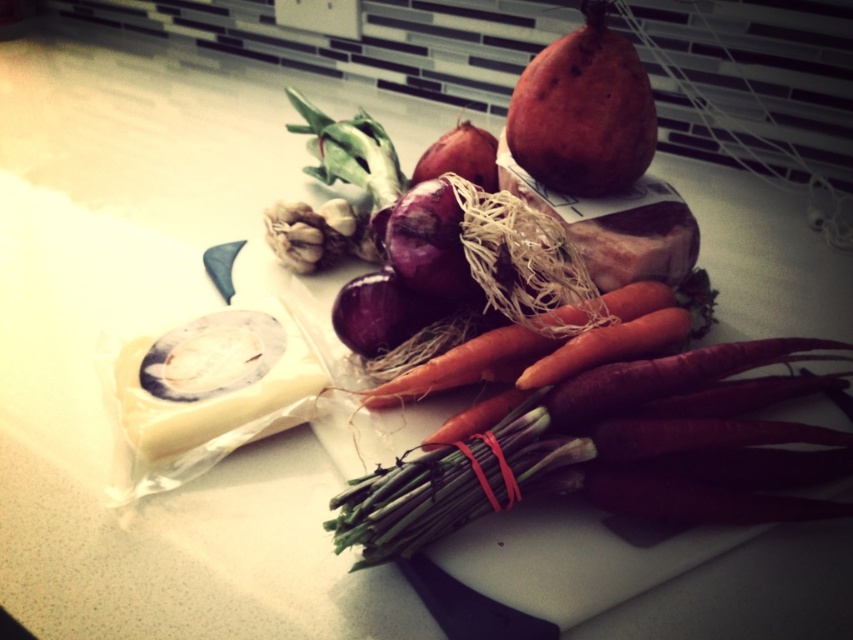
You are a drone flying above the kitchen countertop. You need to land at one of the two points, point A at coordinates point (375, 394) or point B at coordinates point (337, 248). Which point should you choose to land closer to the camera?

You should choose point A at coordinates point (375, 394) to land closer to the camera because it is closer to the camera than point B at coordinates point (337, 248).

You are a chef preparing a dish that requires slicing onions. You have two purple onions available on the countertop. The first is labeled as the purple matte onion at center, and the second is the matte purple onion at center. If you need to choose the larger onion for your recipe, which one should you pick?

The matte purple onion at center is wider than the purple matte onion at center, so you should choose the matte purple onion at center for your recipe.

You are a delivery person who just arrived at the kitchen. You need to place a package on the countertop. The package requires a spot that is at least 30 inches away from the camera to avoid blocking the view. Is the point at coordinates point (538, 125) suitable for placing the package?

The point at coordinates point (538, 125) is 32.74 inches away from the camera, which meets the requirement of being at least 30 inches away. Therefore, it is suitable for placing the package there.